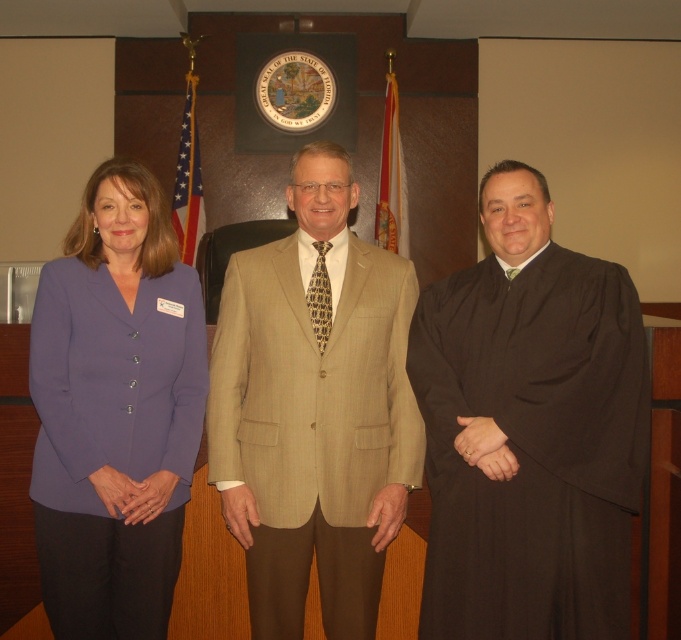
You are an observer in the room. You see the black matte robe at right and the tan pinstripe suit at center. Which one is lower in position?

The black matte robe at right is positioned under the tan pinstripe suit at center, so it is lower in position.

You are standing 2 meters away from a point marked at coordinates point (506,192). Can you reach that point without moving closer?

The distance of point (506,192) from viewer is 2.11 meters, so you are currently 2 meters away from it. Since you need to be at least 2.11 meters away to reach it, you cannot reach the point without moving closer.

Based on the scene described, which object is shorter in height between the black matte robe at right and the tan pinstripe suit at center?

The black matte robe at right is shorter in height compared to the tan pinstripe suit at center.